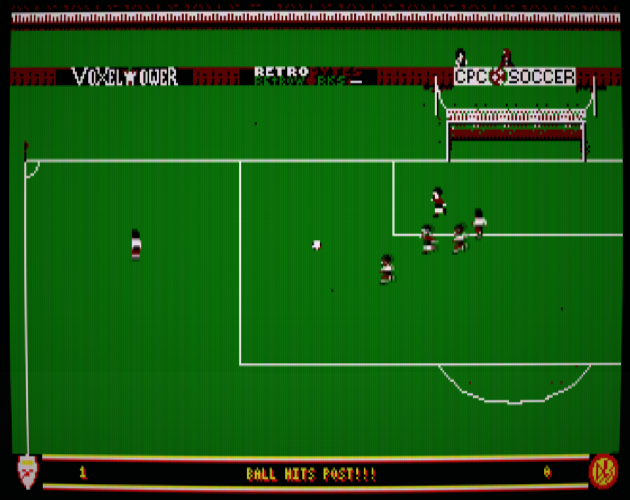
You are a GUI agent. You are given a task and a screenshot of the screen. Output one action in this format:
    pyautogui.click(x=<x>, y=<y>)
    Task: Click on the stands
    This screenshot has height=500, width=630.
    Given the screenshot: What is the action you would take?
    pyautogui.click(x=533, y=117)